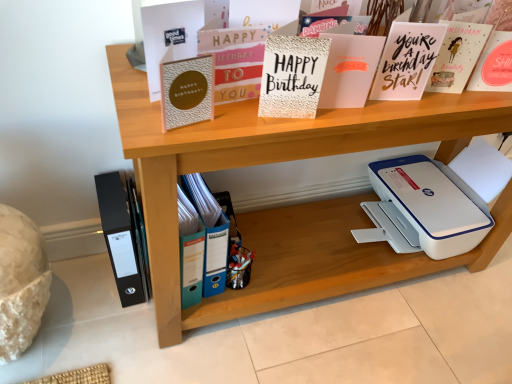
You are a GUI agent. You are given a task and a screenshot of the screen. Output one action in this format:
    pyautogui.click(x=<x>, y=<y>)
    Task: Click on the vacant space that is to the left of black matte folder at lower left
    Image resolution: width=512 pixels, height=384 pixels.
    Given the screenshot: What is the action you would take?
    pyautogui.click(x=84, y=274)